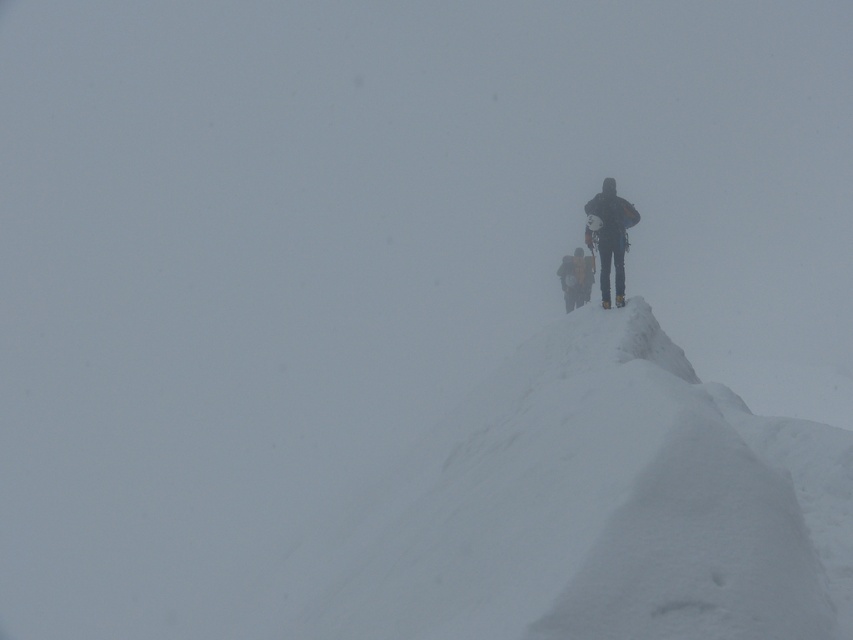
Question: Which point is farther from the camera taking this photo?

Choices:
 (A) (584, 278)
 (B) (619, 241)
 (C) (614, 346)

Answer: (A)

Question: Is dark blue fabric jacket at upper right smaller than yellow fabric backpack at center?

Choices:
 (A) yes
 (B) no

Answer: (A)

Question: Among these objects, which one is nearest to the camera?

Choices:
 (A) dark blue fabric jacket at upper right
 (B) yellow fabric backpack at center
 (C) white snow at center

Answer: (C)

Question: Can you confirm if dark blue fabric jacket at upper right is thinner than yellow fabric backpack at center?

Choices:
 (A) yes
 (B) no

Answer: (B)

Question: Which point is farther from the camera taking this photo?

Choices:
 (A) [x=572, y=298]
 (B) [x=749, y=556]
 (C) [x=604, y=224]

Answer: (A)

Question: Is white snow at center to the left of dark blue fabric jacket at upper right from the viewer's perspective?

Choices:
 (A) yes
 (B) no

Answer: (A)